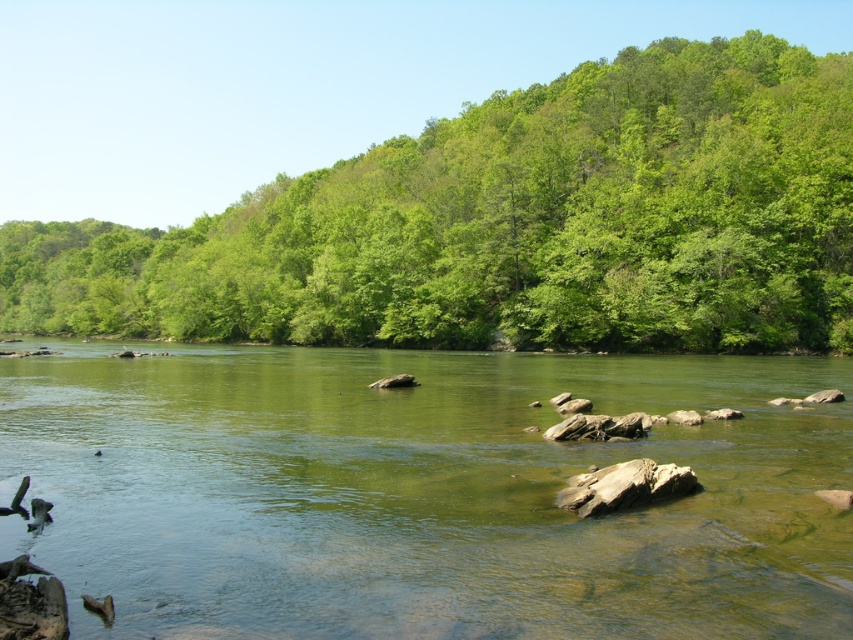
You are a hiker standing at the riverbank. You notice the green translucent water at center and the green leafy trees at upper center. Which one appears closer to you?

The green translucent water at center appears closer because it has a lesser height compared to the green leafy trees at upper center, which are further away.

Based on the scene description, which object takes up more space in the image, the green translucent water at center or the green leafy trees at upper center?

The green leafy trees at upper center occupy more space than the green translucent water at center.